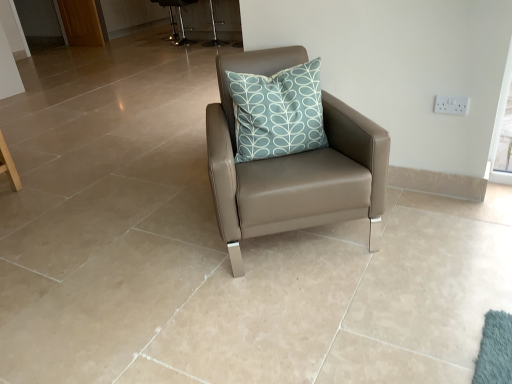
This screenshot has width=512, height=384. In order to click on metallic silver bar stool at upper center, the first bar stool in the right-to-left sequence in this screenshot , I will do pyautogui.click(x=214, y=31).

Image resolution: width=512 pixels, height=384 pixels. What do you see at coordinates (500, 126) in the screenshot?
I see `transparent glass window screen at upper right` at bounding box center [500, 126].

You are a GUI agent. You are given a task and a screenshot of the screen. Output one action in this format:
    pyautogui.click(x=<x>, y=<y>)
    Task: Click on the white plastic electric outlet at upper right
    The image size is (512, 384).
    Given the screenshot: What is the action you would take?
    coord(451,105)

Locate an element on the screen. The width and height of the screenshot is (512, 384). matte leather chair at center is located at coordinates (293, 166).

Which object is further away from the camera, metallic silver bar stool at upper center, the 2th bar stool from the back, or metallic silver bar stool at upper center, arranged as the 2th bar stool when viewed from the front?

Positioned behind is metallic silver bar stool at upper center, arranged as the 2th bar stool when viewed from the front.

In the scene shown: Is metallic silver bar stool at upper center, which is the 1th bar stool in front-to-back order, wider than metallic silver bar stool at upper center, the first bar stool from the back?

No.

Find the location of a particular element. bar stool on the left of the metallic silver bar stool at upper center, which is the 1th bar stool in front-to-back order is located at coordinates (179, 18).

From the image's perspective, is metallic silver bar stool at upper center, which is the 1th bar stool in front-to-back order, on top of metallic silver bar stool at upper center, the first bar stool when ordered from left to right?

No, from the image's perspective, metallic silver bar stool at upper center, which is the 1th bar stool in front-to-back order, is not above metallic silver bar stool at upper center, the first bar stool when ordered from left to right.

From a real-world perspective, which object rests below the other?

metallic silver bar stool at upper center, the first bar stool in the right-to-left sequence, from a real-world perspective.

Considering the sizes of transparent glass window screen at upper right and metallic silver bar stool at upper center, which is the 1th bar stool in front-to-back order, in the image, is transparent glass window screen at upper right wider or thinner than metallic silver bar stool at upper center, which is the 1th bar stool in front-to-back order,?

transparent glass window screen at upper right is thinner than metallic silver bar stool at upper center, which is the 1th bar stool in front-to-back order.

Does transparent glass window screen at upper right turn towards metallic silver bar stool at upper center, which is the 1th bar stool in front-to-back order?

No.

Which is behind, point (494, 141) or point (210, 44)?

The point (210, 44) is behind.

Based on their positions, is transparent glass window screen at upper right located to the left or right of white plastic electric outlet at upper right?

Clearly, transparent glass window screen at upper right is on the right of white plastic electric outlet at upper right in the image.

From a real-world perspective, is transparent glass window screen at upper right positioned above or below white plastic electric outlet at upper right?

Clearly, from a real-world perspective, transparent glass window screen at upper right is above white plastic electric outlet at upper right.

Can you tell me how much transparent glass window screen at upper right and white plastic electric outlet at upper right differ in facing direction?

The angular difference between transparent glass window screen at upper right and white plastic electric outlet at upper right is 91 degrees.

Considering the positions of points (503, 77) and (460, 114), is point (503, 77) closer to camera compared to point (460, 114)?

Yes, it is in front of point (460, 114).

Could brown wooden screen door at upper left be considered to be inside metallic silver bar stool at upper center, the first bar stool from the back?

No, brown wooden screen door at upper left is not a part of metallic silver bar stool at upper center, the first bar stool from the back.

Is metallic silver bar stool at upper center, the first bar stool when ordered from left to right, shorter than brown wooden screen door at upper left?

Yes, metallic silver bar stool at upper center, the first bar stool when ordered from left to right, is shorter than brown wooden screen door at upper left.

Who is more distant, metallic silver bar stool at upper center, the first bar stool when ordered from left to right, or brown wooden screen door at upper left?

Positioned behind is metallic silver bar stool at upper center, the first bar stool when ordered from left to right.

In terms of width, does metallic silver bar stool at upper center, the first bar stool from the back, look wider or thinner when compared to brown wooden screen door at upper left?

In the image, metallic silver bar stool at upper center, the first bar stool from the back, appears to be wider than brown wooden screen door at upper left.

Between matte leather chair at center and metallic silver bar stool at upper center, the first bar stool from the back, which one has larger size?

With larger size is matte leather chair at center.

The image size is (512, 384). I want to click on chair above the metallic silver bar stool at upper center, the second bar stool in the right-to-left sequence (from a real-world perspective), so click(x=293, y=166).

Which is closer to the camera, (x=218, y=148) or (x=164, y=5)?

The point (x=218, y=148) is more forward.

In the scene shown: From the image's perspective, between matte leather chair at center and metallic silver bar stool at upper center, the first bar stool when ordered from left to right, which one is located above?

metallic silver bar stool at upper center, the first bar stool when ordered from left to right, from the image's perspective.

Would you say white plastic electric outlet at upper right is outside transparent glass window screen at upper right?

Yes, white plastic electric outlet at upper right is located beyond the bounds of transparent glass window screen at upper right.

Is white plastic electric outlet at upper right taller or shorter than transparent glass window screen at upper right?

Clearly, white plastic electric outlet at upper right is shorter compared to transparent glass window screen at upper right.

Is white plastic electric outlet at upper right to the left or to the right of transparent glass window screen at upper right in the image?

Based on their positions, white plastic electric outlet at upper right is located to the left of transparent glass window screen at upper right.

Is teal printed cushion at center positioned before transparent glass window screen at upper right?

Yes, teal printed cushion at center is in front of transparent glass window screen at upper right.

Measure the distance from teal printed cushion at center to transparent glass window screen at upper right.

teal printed cushion at center and transparent glass window screen at upper right are 38.93 inches apart from each other.

In the scene shown: Can you see teal printed cushion at center touching transparent glass window screen at upper right?

No, teal printed cushion at center is not next to transparent glass window screen at upper right.

Is teal printed cushion at center facing away from transparent glass window screen at upper right?

No, teal printed cushion at center is not facing the opposite direction of transparent glass window screen at upper right.

This screenshot has height=384, width=512. Identify the location of bar stool on the right of metallic silver bar stool at upper center, arranged as the 2th bar stool when viewed from the front. [214, 31].

In order to click on window screen above the metallic silver bar stool at upper center, the first bar stool in the right-to-left sequence (from a real-world perspective) in this screenshot , I will do `click(500, 126)`.

Considering their positions, is transparent glass window screen at upper right positioned closer to teal printed cushion at center than brown wooden screen door at upper left?

transparent glass window screen at upper right.

When comparing their distances from white plastic electric outlet at upper right, does transparent glass window screen at upper right or metallic silver bar stool at upper center, which is the 1th bar stool in front-to-back order, seem closer?

transparent glass window screen at upper right is positioned closer to the anchor white plastic electric outlet at upper right.

Which object lies further to the anchor point metallic silver bar stool at upper center, the second bar stool in the right-to-left sequence, brown wooden screen door at upper left or matte leather chair at center?

matte leather chair at center is positioned further to the anchor metallic silver bar stool at upper center, the second bar stool in the right-to-left sequence.

Estimate the real-world distances between objects in this image. Which object is closer to metallic silver bar stool at upper center, the first bar stool in the right-to-left sequence, matte leather chair at center or white plastic electric outlet at upper right?

white plastic electric outlet at upper right is positioned closer to the anchor metallic silver bar stool at upper center, the first bar stool in the right-to-left sequence.

When comparing their distances from matte leather chair at center, does white plastic electric outlet at upper right or brown wooden screen door at upper left seem further?

Among the two, brown wooden screen door at upper left is located further to matte leather chair at center.

Estimate the real-world distances between objects in this image. Which object is closer to brown wooden screen door at upper left, transparent glass window screen at upper right or matte leather chair at center?

matte leather chair at center is positioned closer to the anchor brown wooden screen door at upper left.

Considering their positions, is matte leather chair at center positioned closer to brown wooden screen door at upper left than metallic silver bar stool at upper center, arranged as the 2th bar stool when viewed from the front?

The object closer to brown wooden screen door at upper left is metallic silver bar stool at upper center, arranged as the 2th bar stool when viewed from the front.

When comparing their distances from teal printed cushion at center, does matte leather chair at center or white plastic electric outlet at upper right seem further?

Based on the image, white plastic electric outlet at upper right appears to be further to teal printed cushion at center.

Locate an element on the screen. This screenshot has height=384, width=512. bar stool positioned between matte leather chair at center and brown wooden screen door at upper left from near to far is located at coordinates (214, 31).

Locate an element on the screen. This screenshot has height=384, width=512. electric outlet between matte leather chair at center and metallic silver bar stool at upper center, the second bar stool in the right-to-left sequence, in the front-back direction is located at coordinates (451, 105).

Where is `window screen between teal printed cushion at center and metallic silver bar stool at upper center, arranged as the second bar stool when viewed from the left, along the z-axis`? window screen between teal printed cushion at center and metallic silver bar stool at upper center, arranged as the second bar stool when viewed from the left, along the z-axis is located at coordinates (500, 126).

Locate an element on the screen. pillow between matte leather chair at center and metallic silver bar stool at upper center, arranged as the 2th bar stool when viewed from the front, from front to back is located at coordinates (277, 112).